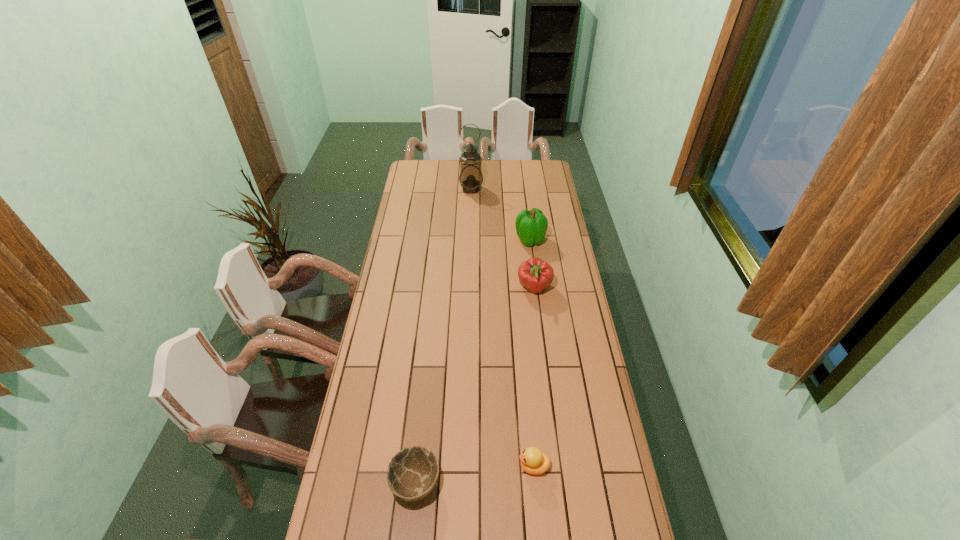
Find the location of a particular element. This screenshot has width=960, height=540. free point between the leftmost object and the farthest object is located at coordinates (444, 336).

Locate an element on the screen. The image size is (960, 540). vacant region between the taller bell pepper and the leftmost object is located at coordinates (473, 361).

Identify the location of unoccupied position between the shorter bell pepper and the duckling. The width and height of the screenshot is (960, 540). (534, 377).

Locate an element on the screen. This screenshot has height=540, width=960. free point between the farthest object and the bowl is located at coordinates (444, 336).

Locate an element on the screen. The height and width of the screenshot is (540, 960). vacant region between the duckling and the leftmost object is located at coordinates (475, 475).

Identify the location of vacant area that lies between the second object from left to right and the leftmost object. Image resolution: width=960 pixels, height=540 pixels. (444, 336).

Identify the location of free space between the oil lamp and the shorter bell pepper. point(503,239).

Where is `vacant point located between the farthest object and the duckling`? vacant point located between the farthest object and the duckling is located at coordinates (502, 327).

Locate an element on the screen. The height and width of the screenshot is (540, 960). vacant area that lies between the nearer bell pepper and the duckling is located at coordinates (534, 377).

Identify which object is located as the nearest to the farther bell pepper. Please provide its 2D coordinates. Your answer should be formatted as a tuple, i.e. [(x, y)], where the tuple contains the x and y coordinates of a point satisfying the conditions above.

[(534, 274)]